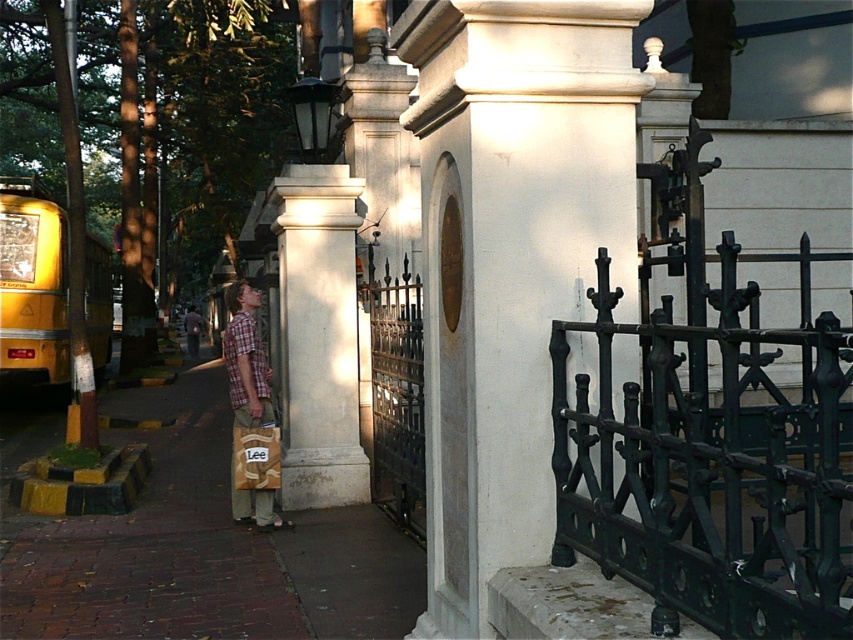
You are a delivery person standing at the camera position. You need to deliver a package to the address behind the green wrought iron gate at center. The package requires a clearance of 6 feet. Can you pass through the gate?

The distance between the green wrought iron gate at center and the camera is 6.16 feet. Since the required clearance is 6 feet, you can pass through the gate as there is enough space.